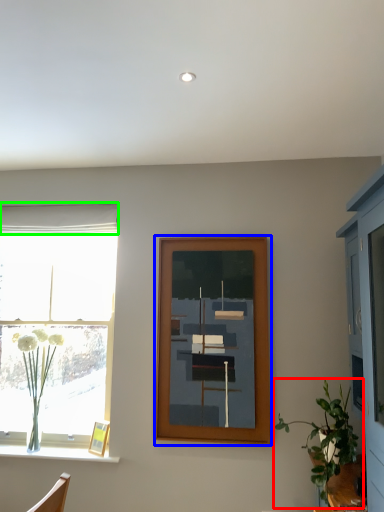
Question: Estimate the real-world distances between objects in this image. Which object is farther from houseplant (highlighted by a red box), picture frame (highlighted by a blue box) or curtain (highlighted by a green box)?

Choices:
 (A) picture frame
 (B) curtain

Answer: (B)